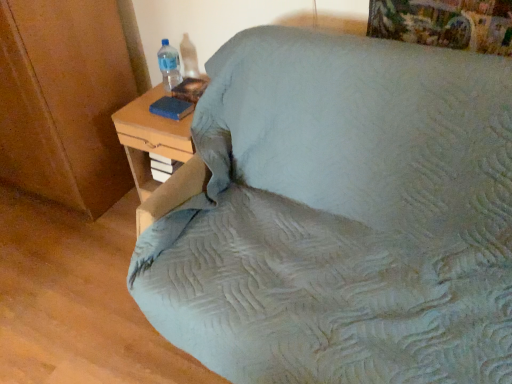
Question: Is woodennightstand at right wider than transparent plastic bottle at upper left?

Choices:
 (A) no
 (B) yes

Answer: (B)

Question: Considering the relative positions of woodennightstand at right and transparent plastic bottle at upper left in the image provided, is woodennightstand at right to the left of transparent plastic bottle at upper left from the viewer's perspective?

Choices:
 (A) yes
 (B) no

Answer: (B)

Question: Is woodennightstand at right aimed at transparent plastic bottle at upper left?

Choices:
 (A) no
 (B) yes

Answer: (A)

Question: Is woodennightstand at right smaller than transparent plastic bottle at upper left?

Choices:
 (A) yes
 (B) no

Answer: (B)

Question: Is woodennightstand at right located outside transparent plastic bottle at upper left?

Choices:
 (A) yes
 (B) no

Answer: (A)

Question: Does woodennightstand at right have a lesser height compared to transparent plastic bottle at upper left?

Choices:
 (A) yes
 (B) no

Answer: (B)

Question: Considering the relative sizes of light blue fabric bed at center and blue matte book at upper left in the image provided, is light blue fabric bed at center smaller than blue matte book at upper left?

Choices:
 (A) yes
 (B) no

Answer: (B)

Question: From the image's perspective, does light blue fabric bed at center appear higher than blue matte book at upper left?

Choices:
 (A) yes
 (B) no

Answer: (B)

Question: Is blue matte book at upper left surrounded by light blue fabric bed at center?

Choices:
 (A) no
 (B) yes

Answer: (A)

Question: From a real-world perspective, is light blue fabric bed at center positioned under blue matte book at upper left based on gravity?

Choices:
 (A) yes
 (B) no

Answer: (A)

Question: From a real-world perspective, is light blue fabric bed at center located higher than blue matte book at upper left?

Choices:
 (A) no
 (B) yes

Answer: (A)

Question: Can you confirm if light blue fabric bed at center is wider than blue matte book at upper left?

Choices:
 (A) yes
 (B) no

Answer: (A)

Question: Is blue matte book at upper left turned away from light blue fabric bed at center?

Choices:
 (A) no
 (B) yes

Answer: (A)